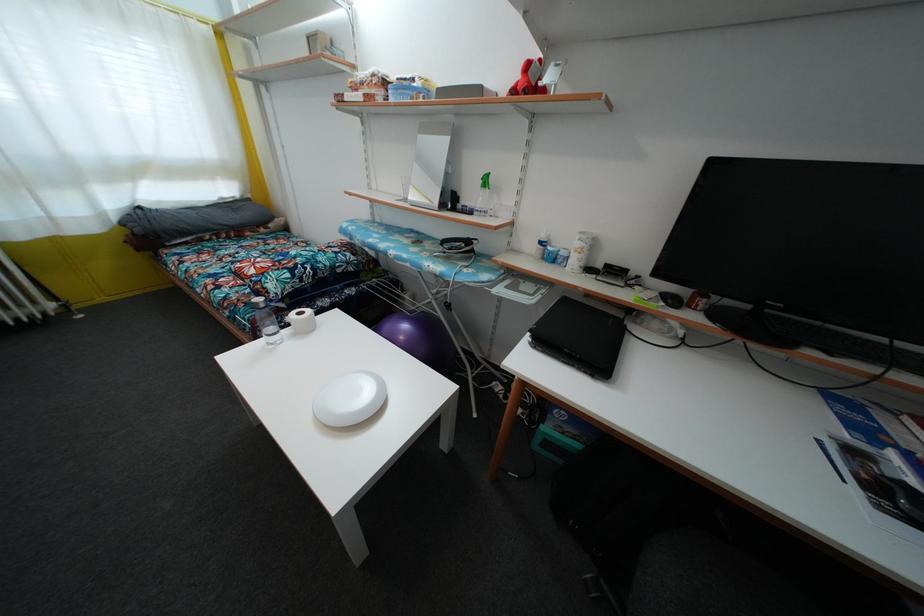
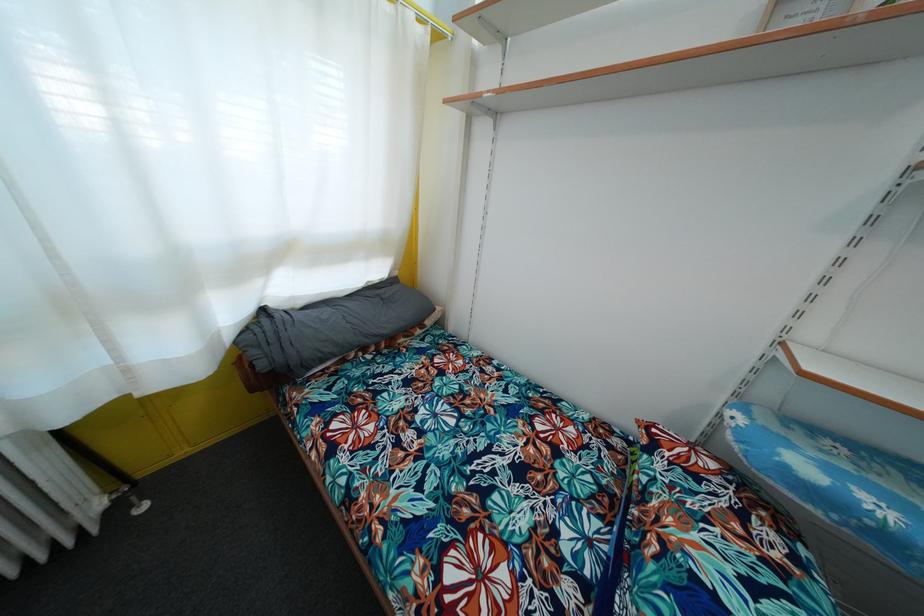
The images are taken continuously from a first-person perspective. In which direction are you moving?

The movement direction of the cameraman is left, forward.